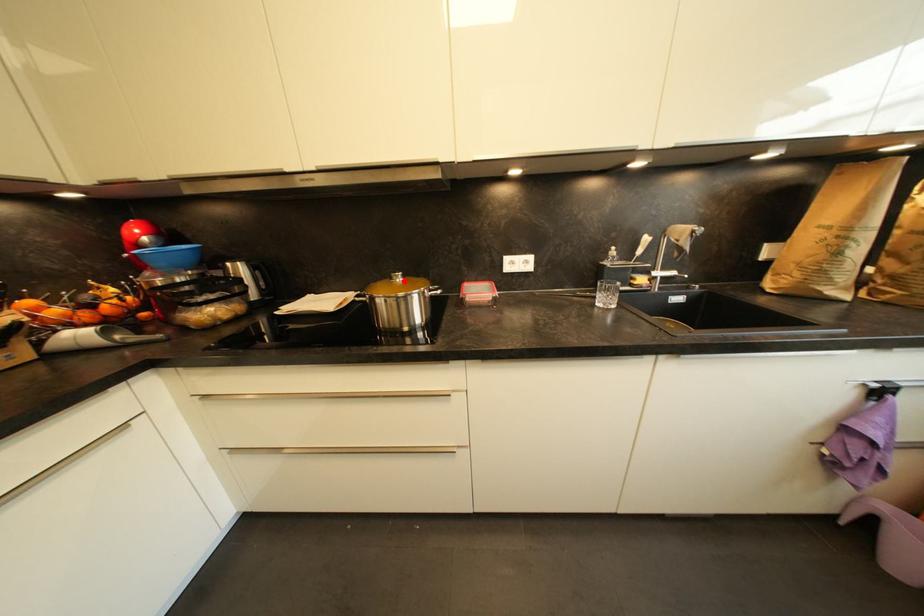
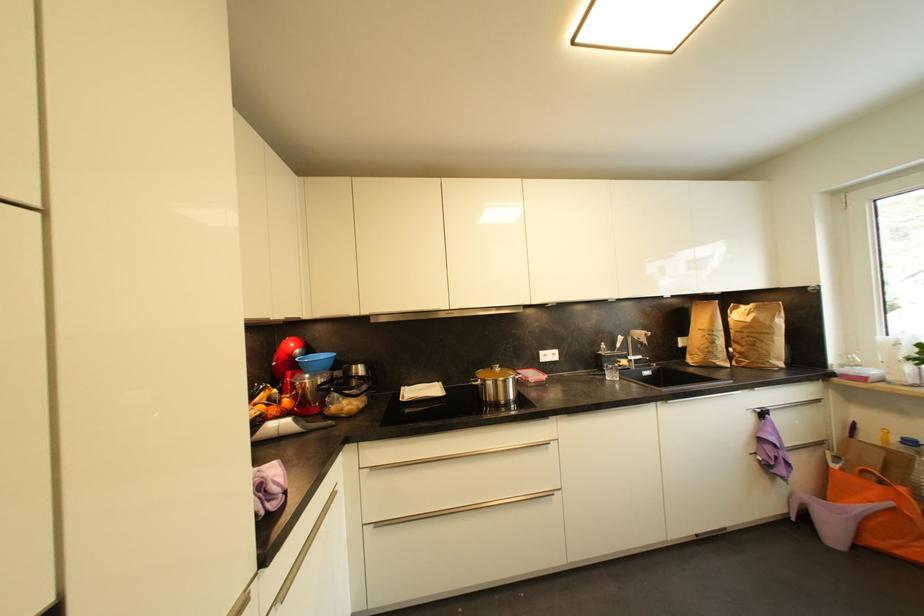
Locate, in the second image, the point that corresponds to the highlighted location in the first image.

(503, 371)